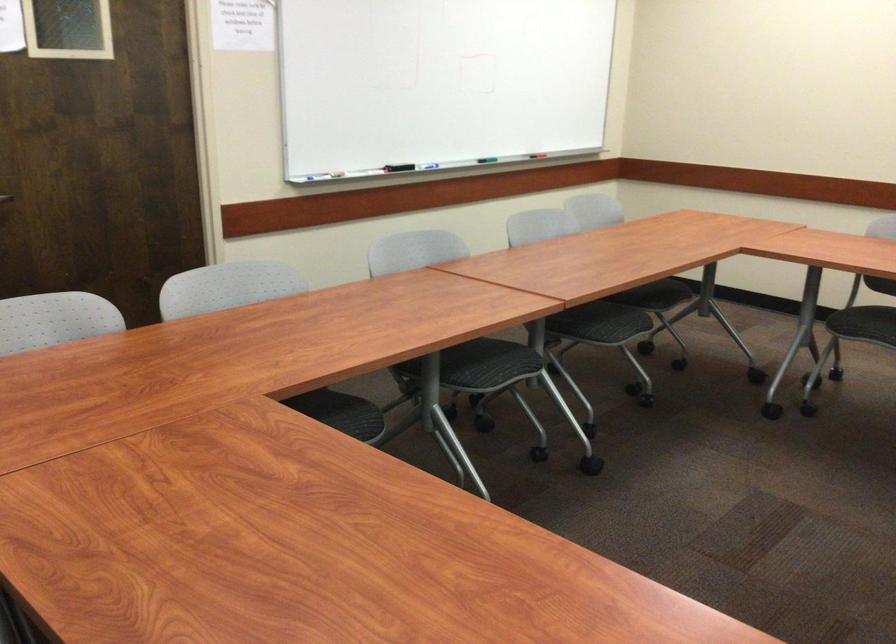
Describe the element at coordinates (438, 82) in the screenshot. I see `the blue whiteboard marker` at that location.